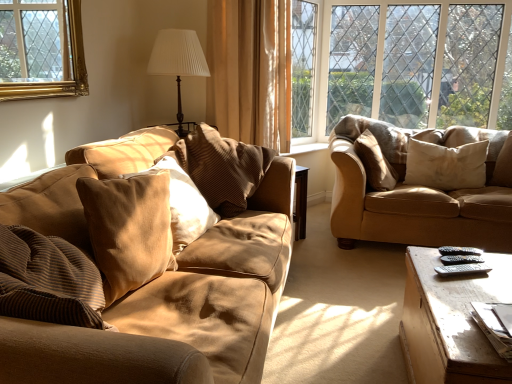
Image resolution: width=512 pixels, height=384 pixels. Describe the element at coordinates (250, 71) in the screenshot. I see `brown fabric curtain at center` at that location.

What is the approximate width of clear glass window at upper right?

It is 4.10 inches.

This screenshot has width=512, height=384. Describe the element at coordinates (183, 203) in the screenshot. I see `suede-like beige pillow at center-left, marked as the 4th pillow in a right-to-left arrangement` at that location.

Locate an element on the screen. Image resolution: width=512 pixels, height=384 pixels. brown fabric curtain at center is located at coordinates click(x=250, y=71).

From a real-world perspective, is white pleated fabric at upper center on suede-like beige pillow at right, which is the second pillow from right to left?

Yes, from a real-world perspective, white pleated fabric at upper center is over suede-like beige pillow at right, which is the second pillow from right to left

Visually, is white pleated fabric at upper center positioned to the left or to the right of suede-like beige pillow at right, which is the second pillow from right to left?

white pleated fabric at upper center is positioned on suede-like beige pillow at right, which is the second pillow from right to left,'s left side.

Which point is more forward, (x=177, y=42) or (x=380, y=162)?

The point (x=177, y=42) is more forward.

Is white pleated fabric at upper center next to suede-like beige pillow at right, positioned as the fourth pillow in left-to-right order?

No, white pleated fabric at upper center is not with suede-like beige pillow at right, positioned as the fourth pillow in left-to-right order.

Can you confirm if suede pillow at left, the first pillow from the left, is wider than brown fabric curtain at center?

Correct, the width of suede pillow at left, the first pillow from the left, exceeds that of brown fabric curtain at center.

Would you say suede pillow at left, arranged as the 5th pillow when viewed from the right, is to the left or to the right of brown fabric curtain at center in the picture?

Based on their positions, suede pillow at left, arranged as the 5th pillow when viewed from the right, is located to the left of brown fabric curtain at center.

Which is behind, point (97, 265) or point (241, 44)?

The point (241, 44) is behind.

From a real-world perspective, does suede pillow at left, arranged as the 5th pillow when viewed from the right, stand above brown fabric curtain at center?

Incorrect, from a real-world perspective, suede pillow at left, arranged as the 5th pillow when viewed from the right, is lower than brown fabric curtain at center.

Which of these two, beige soft cushion at right, the fifth pillow in the left-to-right sequence, or clear glass window at upper right, stands taller?

clear glass window at upper right is taller.

Is clear glass window at upper right inside beige soft cushion at right, the 1th pillow when ordered from right to left?

Actually, clear glass window at upper right is outside beige soft cushion at right, the 1th pillow when ordered from right to left.

Is beige soft cushion at right, the 1th pillow when ordered from right to left, wider or thinner than clear glass window at upper right?

In the image, beige soft cushion at right, the 1th pillow when ordered from right to left, appears to be wider than clear glass window at upper right.

Could you measure the distance between beige soft cushion at right, the 1th pillow when ordered from right to left, and clear glass window at upper right?

The distance of beige soft cushion at right, the 1th pillow when ordered from right to left, from clear glass window at upper right is 1.16 meters.

Is suede-like beige pillow at right, positioned as the fourth pillow in left-to-right order, facing away from suede beige couch at right, the first studio couch viewed from the right?

Yes, suede-like beige pillow at right, positioned as the fourth pillow in left-to-right order, is facing away from suede beige couch at right, the first studio couch viewed from the right.

Based on their positions, is suede-like beige pillow at right, positioned as the fourth pillow in left-to-right order, located to the left or right of suede beige couch at right, the second studio couch viewed from the left?

In the image, suede-like beige pillow at right, positioned as the fourth pillow in left-to-right order, appears on the left side of suede beige couch at right, the second studio couch viewed from the left.

Based on the photo, is suede-like beige pillow at right, positioned as the fourth pillow in left-to-right order, far from suede beige couch at right, the second studio couch viewed from the left?

No, suede-like beige pillow at right, positioned as the fourth pillow in left-to-right order, is not far from suede beige couch at right, the second studio couch viewed from the left.

Considering the sizes of objects suede-like beige pillow at right, which is the second pillow from right to left, and suede beige couch at right, the first studio couch viewed from the right, in the image provided, who is smaller, suede-like beige pillow at right, which is the second pillow from right to left, or suede beige couch at right, the first studio couch viewed from the right,?

suede-like beige pillow at right, which is the second pillow from right to left.

Consider the image. Who is shorter, suede beige couch at right, arranged as the 1th studio couch when viewed from the back, or wooden coffee table at lower right?

With less height is wooden coffee table at lower right.

Can you confirm if suede beige couch at right, arranged as the 1th studio couch when viewed from the back, is thinner than wooden coffee table at lower right?

No.

In the image, is suede beige couch at right, the second studio couch viewed from the left, on the left side or the right side of wooden coffee table at lower right?

From the image, it's evident that suede beige couch at right, the second studio couch viewed from the left, is to the right of wooden coffee table at lower right.

Can you confirm if suede beige couch at right, arranged as the 1th studio couch when viewed from the back, is smaller than wooden coffee table at lower right?

Actually, suede beige couch at right, arranged as the 1th studio couch when viewed from the back, might be larger than wooden coffee table at lower right.

Is wooden coffee table at lower right positioned behind suede-like beige pillow at right, which is the second pillow from right to left?

No, wooden coffee table at lower right is closer to the viewer.

From the image's perspective, is wooden coffee table at lower right located beneath suede-like beige pillow at right, which is the second pillow from right to left?

Indeed, from the image's perspective, wooden coffee table at lower right is shown beneath suede-like beige pillow at right, which is the second pillow from right to left.

Which of these two, wooden coffee table at lower right or suede-like beige pillow at right, positioned as the fourth pillow in left-to-right order, is bigger?

wooden coffee table at lower right is bigger.

Measure the distance from suede-like beige pillow at right, positioned as the fourth pillow in left-to-right order, to white pleated fabric at upper center.

1.28 meters.

Is suede-like beige pillow at right, which is the second pillow from right to left, looking in the opposite direction of white pleated fabric at upper center?

Yes, white pleated fabric at upper center is at the back of suede-like beige pillow at right, which is the second pillow from right to left.

Do you think suede-like beige pillow at right, which is the second pillow from right to left, is within white pleated fabric at upper center, or outside of it?

suede-like beige pillow at right, which is the second pillow from right to left, is outside white pleated fabric at upper center.

Where is `the 4th pillow counting from the right side of the white pleated fabric at upper center`? The height and width of the screenshot is (384, 512). the 4th pillow counting from the right side of the white pleated fabric at upper center is located at coordinates (375, 163).

This screenshot has width=512, height=384. Find the location of `curtain lying above the suede pillow at left, the first pillow from the left (from the image's perspective)`. curtain lying above the suede pillow at left, the first pillow from the left (from the image's perspective) is located at coordinates (250, 71).

Estimate the real-world distances between objects in this image. Which object is further from beige soft cushion at right, the fifth pillow in the left-to-right sequence, suede-like beige pillow at center-left, placed as the second pillow when sorted from left to right, or suede pillow at left, arranged as the 5th pillow when viewed from the right?

suede pillow at left, arranged as the 5th pillow when viewed from the right, lies further to beige soft cushion at right, the fifth pillow in the left-to-right sequence, than the other object.

Consider the image. When comparing their distances from clear glass window at upper right, does suede pillow at left, the first pillow from the left, or suede-like beige pillow at center-left, placed as the second pillow when sorted from left to right, seem closer?

suede-like beige pillow at center-left, placed as the second pillow when sorted from left to right, lies closer to clear glass window at upper right than the other object.

Looking at the image, which one is located further to brown fabric curtain at center, brown striped pillow at center, which ranks as the 3th pillow in left-to-right order, or beige soft cushion at right, the 1th pillow when ordered from right to left?

beige soft cushion at right, the 1th pillow when ordered from right to left, lies further to brown fabric curtain at center than the other object.

From the image, which object appears to be farther from suede-like brown couch at left, the 2th studio couch from the back, suede pillow at left, the first pillow from the left, or clear glass window at upper right?

clear glass window at upper right.

Based on their spatial positions, is clear glass window at upper right or suede-like brown couch at left, the 2th studio couch from the right, closer to white pleated fabric at upper center?

suede-like brown couch at left, the 2th studio couch from the right, is closer to white pleated fabric at upper center.

Estimate the real-world distances between objects in this image. Which object is further from suede-like beige pillow at center-left, placed as the second pillow when sorted from left to right, brown striped pillow at center, acting as the 3th pillow starting from the right, or clear glass window at upper right?

clear glass window at upper right is positioned further to the anchor suede-like beige pillow at center-left, placed as the second pillow when sorted from left to right.

Which object lies further to the anchor point brown striped pillow at center, which ranks as the 3th pillow in left-to-right order, suede-like brown couch at left, positioned as the 1th studio couch in left-to-right order, or suede beige couch at right, the second studio couch viewed from the left?

The object further to brown striped pillow at center, which ranks as the 3th pillow in left-to-right order, is suede beige couch at right, the second studio couch viewed from the left.

From the image, which object appears to be farther from brown striped pillow at center, acting as the 3th pillow starting from the right, suede-like beige pillow at center-left, placed as the second pillow when sorted from left to right, or wooden coffee table at lower right?

The object further to brown striped pillow at center, acting as the 3th pillow starting from the right, is wooden coffee table at lower right.

Identify the location of curtain situated between suede-like beige pillow at center-left, marked as the 4th pillow in a right-to-left arrangement, and suede-like beige pillow at right, which is the second pillow from right to left, from left to right. Image resolution: width=512 pixels, height=384 pixels. (250, 71).

What are the coordinates of `studio couch positioned between suede-like brown couch at left, acting as the first studio couch starting from the front, and clear glass window at upper right from near to far` in the screenshot? It's located at (420, 192).

Find the location of `table located between suede-like brown couch at left, positioned as the 1th studio couch in left-to-right order, and beige soft cushion at right, the fifth pillow in the left-to-right sequence, in the depth direction`. table located between suede-like brown couch at left, positioned as the 1th studio couch in left-to-right order, and beige soft cushion at right, the fifth pillow in the left-to-right sequence, in the depth direction is located at coordinates (451, 321).

You are a GUI agent. You are given a task and a screenshot of the screen. Output one action in this format:
    pyautogui.click(x=<x>, y=<y>)
    Task: Click on the table lamp located between suede-like beige pillow at center-left, marked as the 4th pillow in a right-to-left arrangement, and brown fabric curtain at center in the depth direction
    
    Given the screenshot: What is the action you would take?
    pyautogui.click(x=178, y=63)